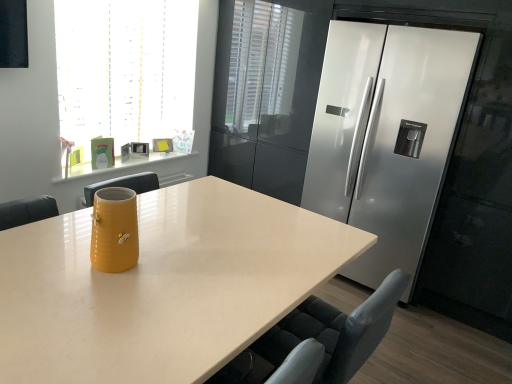
Question: Are matte yellow vase at center and translucent glass window at upper left located far from each other?

Choices:
 (A) no
 (B) yes

Answer: (B)

Question: Does matte yellow vase at center come behind translucent glass window at upper left?

Choices:
 (A) no
 (B) yes

Answer: (A)

Question: Would you say matte yellow vase at center contains translucent glass window at upper left?

Choices:
 (A) no
 (B) yes

Answer: (A)

Question: Does matte yellow vase at center have a greater width compared to translucent glass window at upper left?

Choices:
 (A) no
 (B) yes

Answer: (B)

Question: Considering the relative positions of matte yellow vase at center and translucent glass window at upper left in the image provided, is matte yellow vase at center to the right of translucent glass window at upper left from the viewer's perspective?

Choices:
 (A) no
 (B) yes

Answer: (B)

Question: Considering the relative sizes of matte yellow vase at center and translucent glass window at upper left in the image provided, is matte yellow vase at center shorter than translucent glass window at upper left?

Choices:
 (A) no
 (B) yes

Answer: (B)

Question: Is translucent glass window at upper left shorter than yellow ceramic vase at center?

Choices:
 (A) yes
 (B) no

Answer: (B)

Question: Is translucent glass window at upper left to the left of yellow ceramic vase at center from the viewer's perspective?

Choices:
 (A) yes
 (B) no

Answer: (A)

Question: Does translucent glass window at upper left lie behind yellow ceramic vase at center?

Choices:
 (A) yes
 (B) no

Answer: (A)

Question: Considering the relative sizes of translucent glass window at upper left and yellow ceramic vase at center in the image provided, is translucent glass window at upper left thinner than yellow ceramic vase at center?

Choices:
 (A) yes
 (B) no

Answer: (B)

Question: Is yellow ceramic vase at center at the back of translucent glass window at upper left?

Choices:
 (A) no
 (B) yes

Answer: (A)

Question: Is translucent glass window at upper left positioned before yellow ceramic vase at center?

Choices:
 (A) no
 (B) yes

Answer: (A)

Question: From a real-world perspective, is matte yellow vase at center on yellow matte mug at upper left?

Choices:
 (A) yes
 (B) no

Answer: (B)